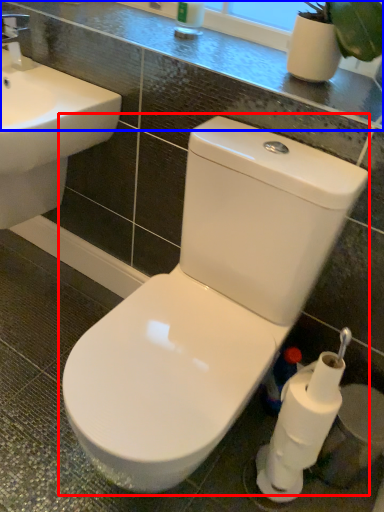
Question: Which object is further to the camera taking this photo, toilet (highlighted by a red box) or counter top (highlighted by a blue box)?

Choices:
 (A) toilet
 (B) counter top

Answer: (B)